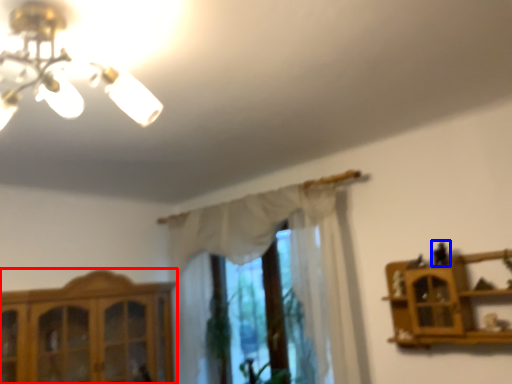
Question: Which point is closer to the camera, cabinetry (highlighted by a red box) or toy (highlighted by a blue box)?

Choices:
 (A) cabinetry
 (B) toy

Answer: (B)